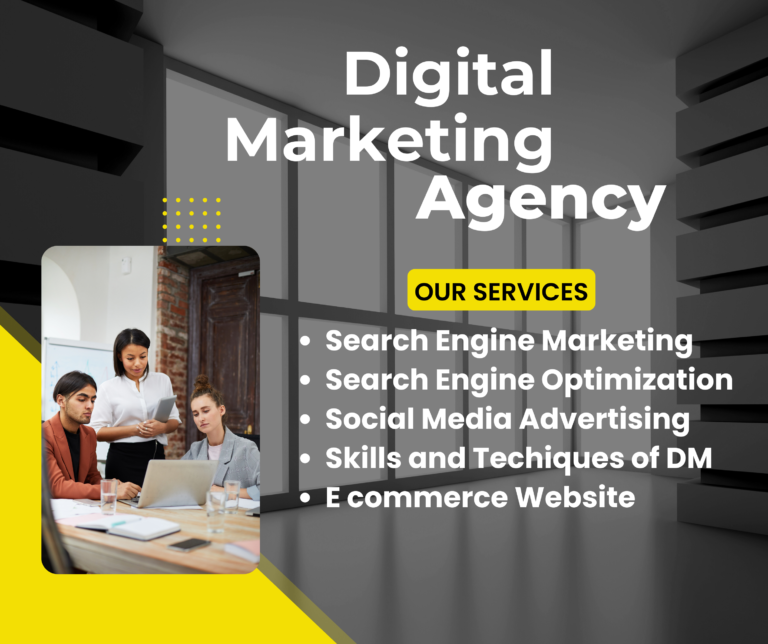
Where is `desk`? This screenshot has height=644, width=768. desk is located at coordinates (219, 556).